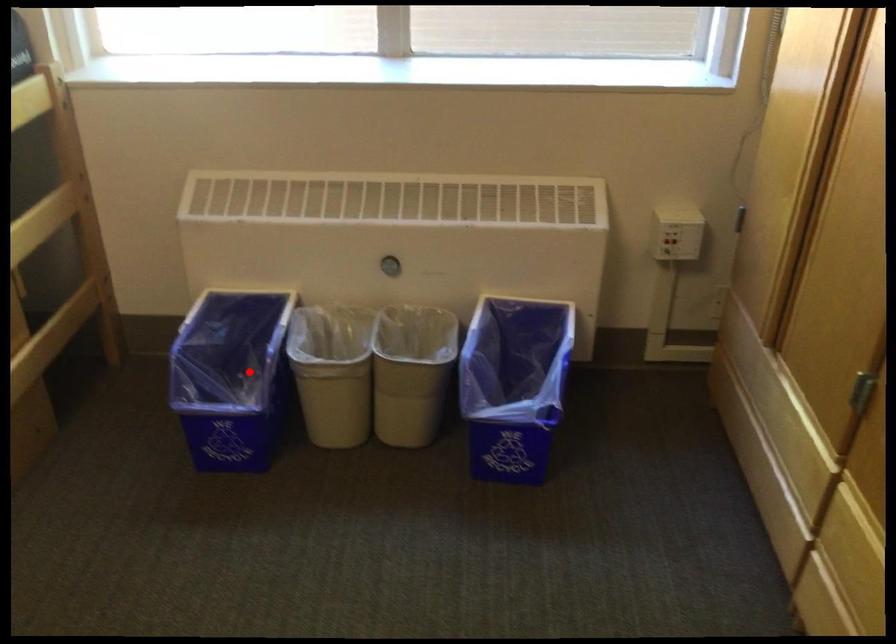
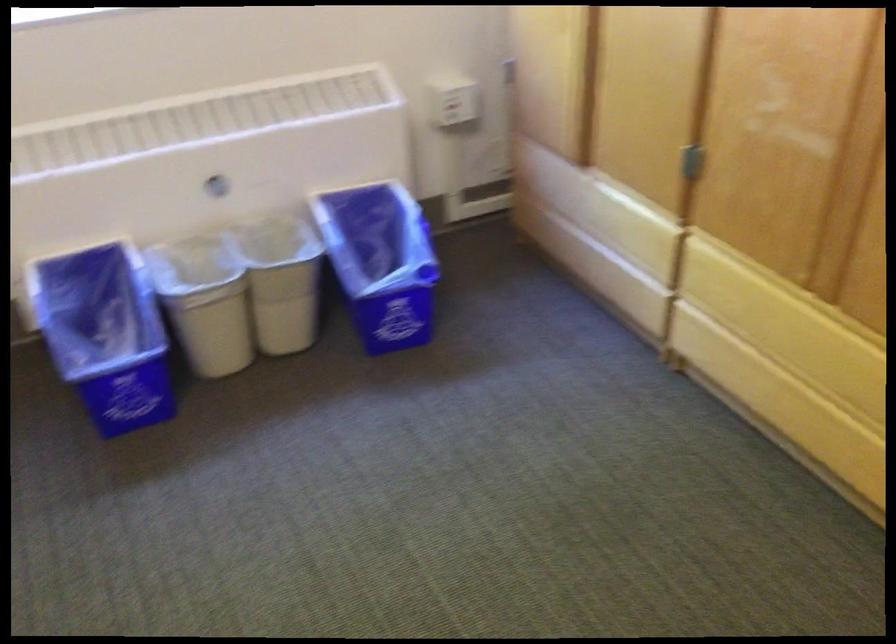
Locate, in the second image, the point that corresponds to the highlighted location in the first image.

(105, 334)